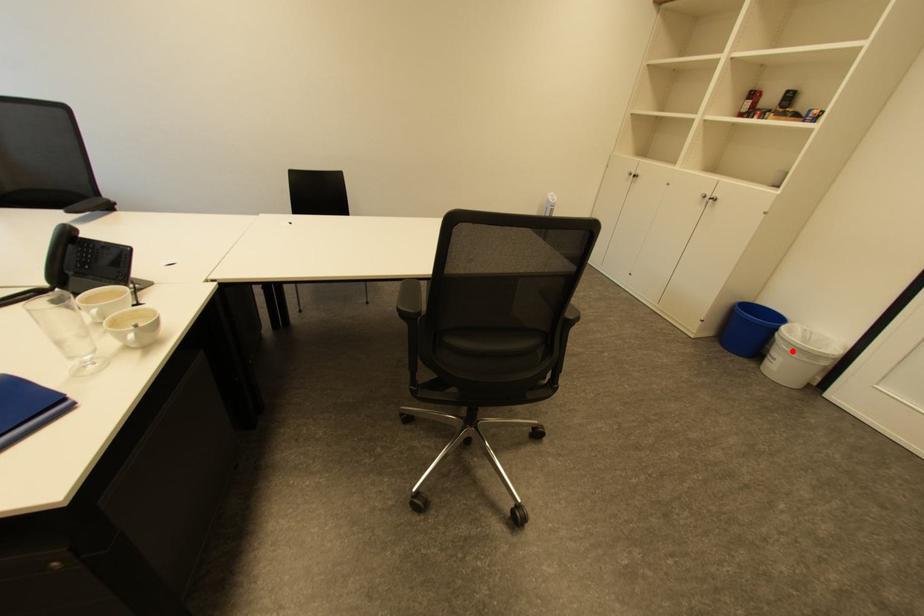
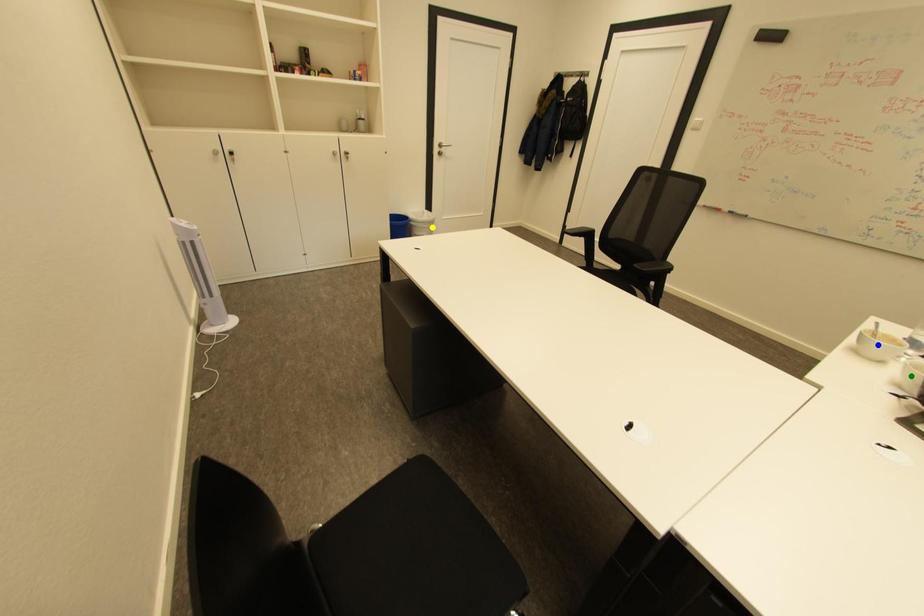
Question: I am providing you with two images of the same scene from different viewpoints. A red point is marked on the first image. You are given multiple points on the second image. In image 2, which mark is for the same physical point as the one in image 1?

Choices:
 (A) blue point
 (B) green point
 (C) yellow point

Answer: (C)